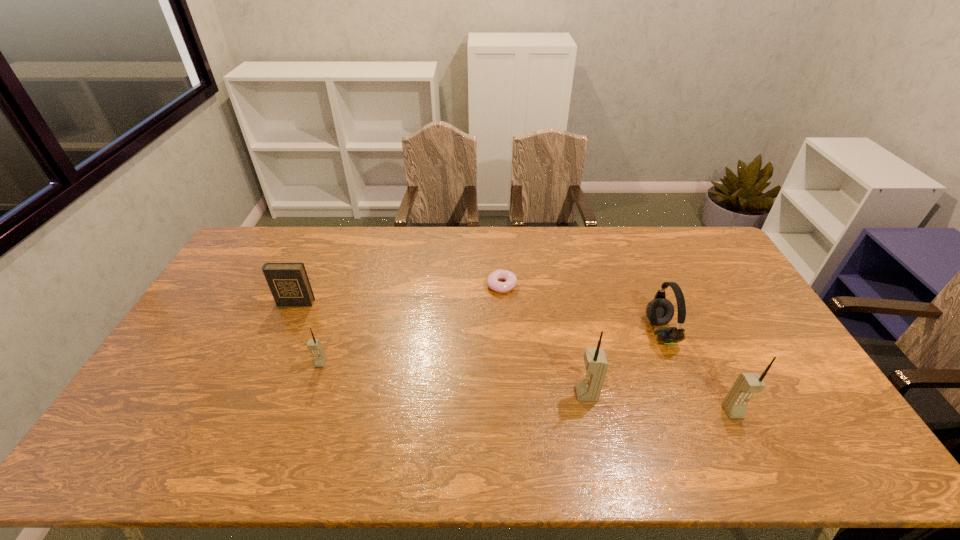
At what (x,y) coordinates should I click in order to perform the action: click on vacant space located 0.100m on the left of the farthest object. Please return your answer as a coordinate pair (x, y). Looking at the image, I should click on point(457,286).

You are a GUI agent. You are given a task and a screenshot of the screen. Output one action in this format:
    pyautogui.click(x=<x>, y=<y>)
    Task: Click on the vacant position at the far edge of the desktop
    This screenshot has width=960, height=540.
    Given the screenshot: What is the action you would take?
    pyautogui.click(x=639, y=231)

I want to click on vacant space at the near edge of the desktop, so click(375, 409).

Identify the location of vacant space at the left edge of the desktop. Image resolution: width=960 pixels, height=540 pixels. (245, 291).

This screenshot has width=960, height=540. I want to click on blank space at the right edge of the desktop, so click(731, 281).

In the image, there is a desktop. Identify the location of free space at the far right corner. (689, 255).

The height and width of the screenshot is (540, 960). In order to click on vacant space in between the nearest object and the second nearest cellular telephone in this screenshot , I will do `click(660, 403)`.

Find the location of `blank region between the second object from left to right and the fifth nearest object`. blank region between the second object from left to right and the fifth nearest object is located at coordinates (308, 333).

Where is `vacant point located between the fifth nearest object and the second tallest cellular telephone`? The image size is (960, 540). vacant point located between the fifth nearest object and the second tallest cellular telephone is located at coordinates (515, 357).

I want to click on blank region between the third object from right to left and the farthest object, so click(544, 340).